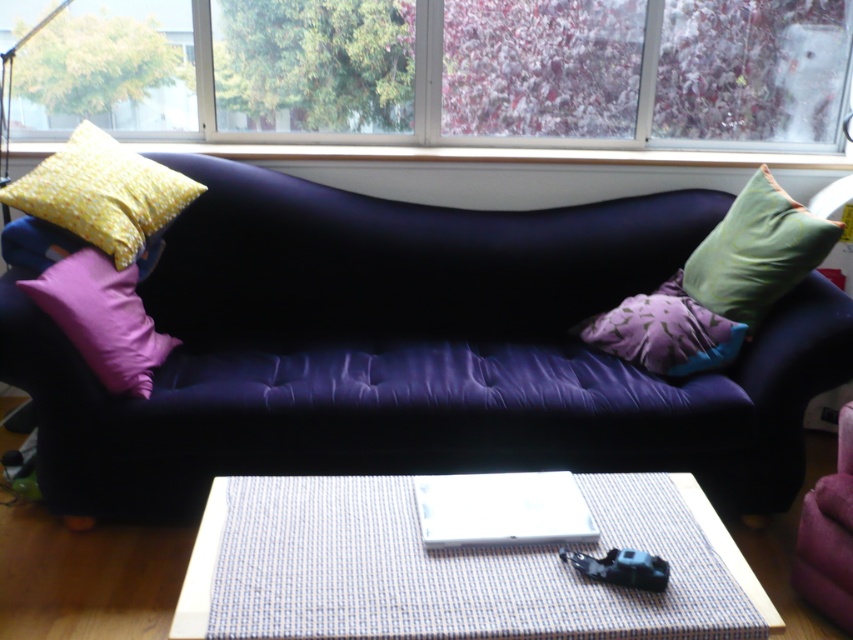
You are sitting on the dark blue sofa and want to see the view outside through the transparent glass window at upper center. However, the green fabric pillow at right is blocking your view. Can you move the pillow to the side to get a clear view?

The transparent glass window at upper center is larger than the green fabric pillow at right, so moving the green fabric pillow at right aside would allow you to see through the transparent glass window at upper center without obstruction.

You are standing in the living room and want to place a new decorative item on the coffee table. The coffee table is located in front of the sofa. Which object from the scene can help you determine the exact location to place the item so it aligns with the purple fabric pillow at left?

The purple fabric pillow at left is positioned at point (102, 317), so you can use its coordinates to align the new decorative item on the coffee table.

Based on the photo, you are sitting on the dark blue sofa and want to place your phone on the closest surface. The white plastic pad at center is the only flat surface available. Can you reach it from your current position?

The white plastic pad at center is located at point (502, 508), so yes, you can reach it from the dark blue sofa as it is within a comfortable distance.